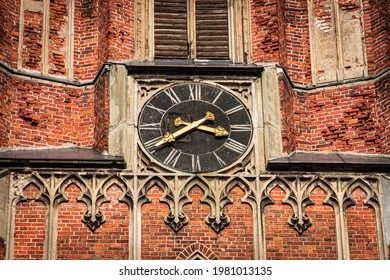
Locate an element on the screen. The image size is (390, 280). archway is located at coordinates (196, 248).